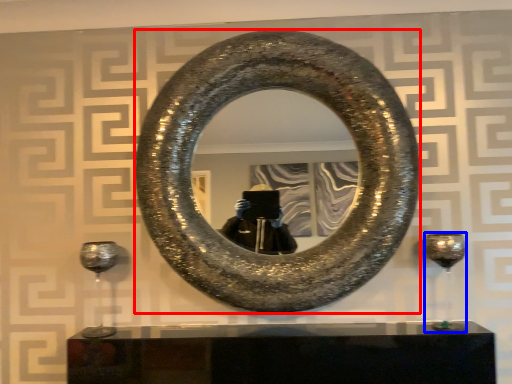
Question: Among these objects, which one is farthest to the camera, horseshoe (highlighted by a red box) or wine glass (highlighted by a blue box)?

Choices:
 (A) horseshoe
 (B) wine glass

Answer: (B)